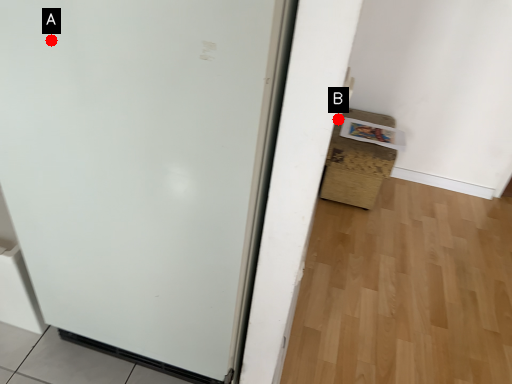
Question: Two points are circled on the image, labeled by A and B beside each circle. Which point is further to the camera?

Choices:
 (A) A is further
 (B) B is further

Answer: (B)